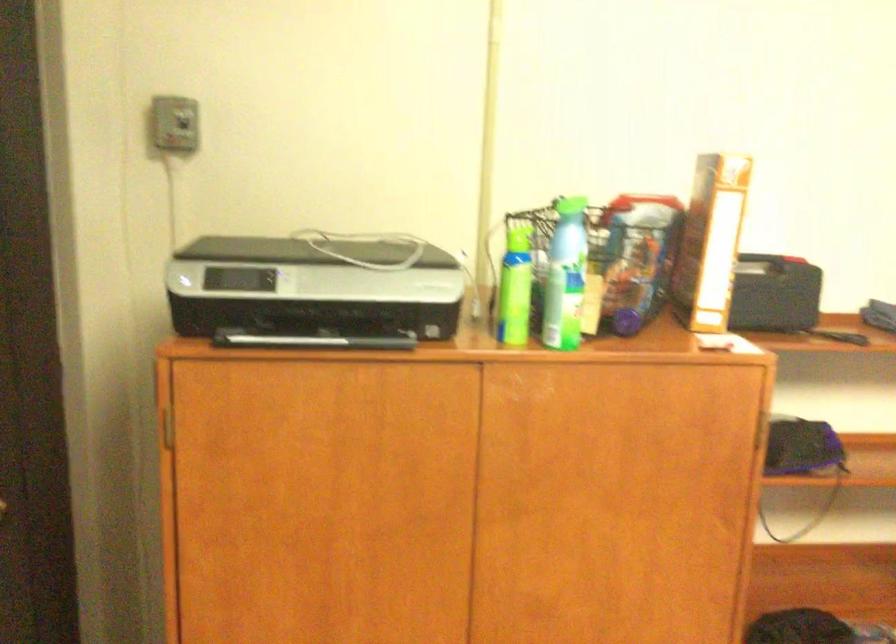
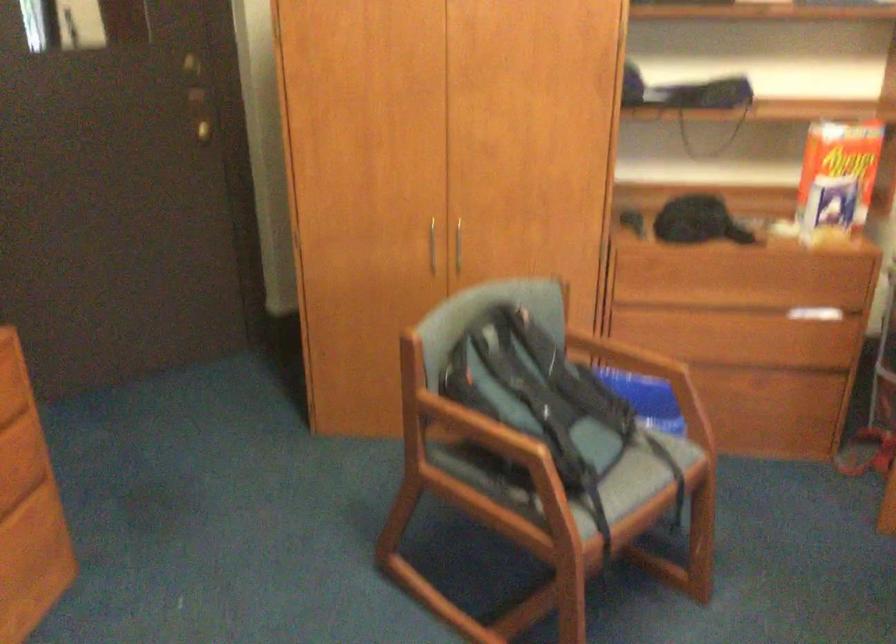
Which direction would the cameraman need to move to produce the second image?

The cameraman moved toward right, backward.